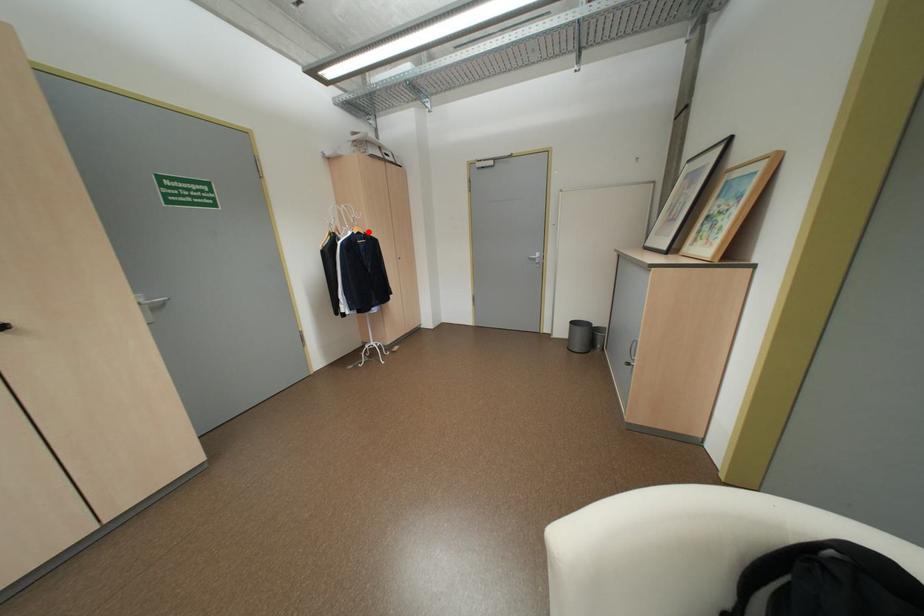
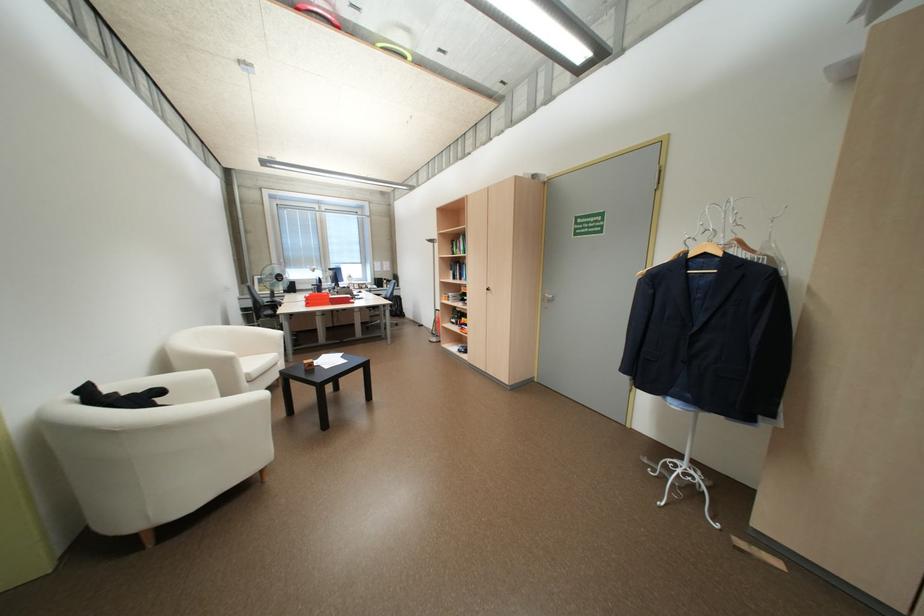
Find the pixel in the second image that matches the highlighted location in the first image.

(714, 254)